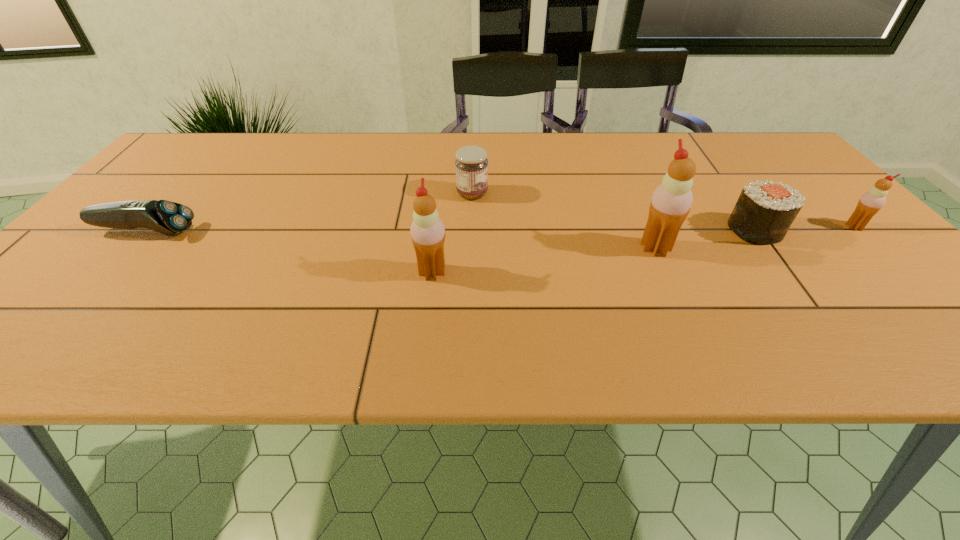
Where is `free space at the near edge`? The image size is (960, 540). free space at the near edge is located at coordinates (579, 319).

Identify the location of free region at the left edge. (127, 255).

Image resolution: width=960 pixels, height=540 pixels. I want to click on vacant region at the right edge, so [x=822, y=200].

The image size is (960, 540). In the image, there is a desktop. Identify the location of vacant region at the far left corner. [221, 142].

In the image, there is a desktop. Identify the location of vacant space at the near left corner. This screenshot has height=540, width=960. (15, 318).

Find the location of a particular element. The height and width of the screenshot is (540, 960). unoccupied position between the nearest icecream and the electric shaver is located at coordinates (289, 252).

You are a GUI agent. You are given a task and a screenshot of the screen. Output one action in this format:
    pyautogui.click(x=<x>, y=<y>)
    Task: Click on the vacant point located between the second object from left to right and the third object from right to left
    
    Given the screenshot: What is the action you would take?
    pyautogui.click(x=543, y=260)

At what (x,y) coordinates should I click in order to perform the action: click on vacant area between the jam and the second icecream from right to left. Please return your answer as a coordinate pair (x, y). This screenshot has height=540, width=960. Looking at the image, I should click on (564, 221).

In order to click on unoccupied position between the fourth object from left to right and the nearest icecream in this screenshot , I will do `click(543, 260)`.

Find the location of a particular element. free space between the nearest icecream and the farthest icecream is located at coordinates (643, 249).